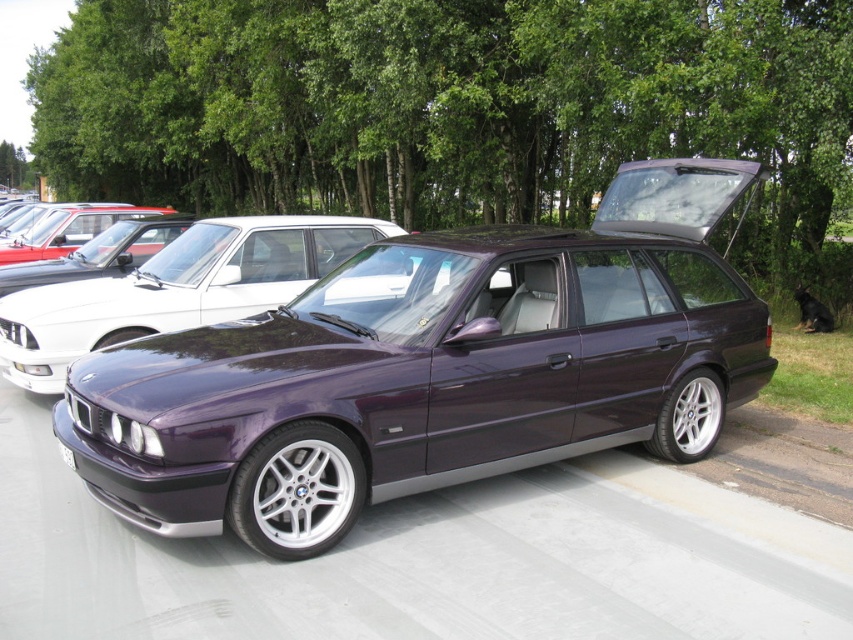
How much distance is there between purple metallic car at center and shiny purple car at center?

purple metallic car at center and shiny purple car at center are 2.52 meters apart.

Locate an element on the screen. purple metallic car at center is located at coordinates (431, 369).

Consider the image. Is purple metallic car at center shorter than matte black car at center?

Correct, purple metallic car at center is not as tall as matte black car at center.

Is the position of purple metallic car at center more distant than that of matte black car at center?

That is False.

Who is more distant from viewer, [222,401] or [16,240]?

Point [16,240]

Locate an element on the screen. The width and height of the screenshot is (853, 640). purple metallic car at center is located at coordinates (431, 369).

Is the position of shiny purple car at center less distant than that of matte black car at center?

Yes, it is in front of matte black car at center.

Who is more forward, (4, 340) or (152, 212)?

Point (4, 340) is in front.

Is point (126, 280) positioned before point (74, 212)?

Yes, point (126, 280) is closer to viewer.

Identify the location of shiny purple car at center. coord(175,289).